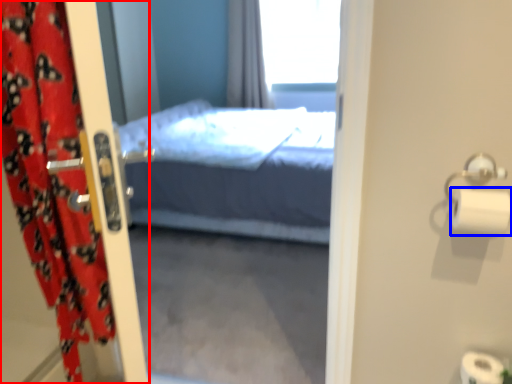
Question: Which object is closer to the camera taking this photo, curtain (highlighted by a red box) or toilet paper (highlighted by a blue box)?

Choices:
 (A) curtain
 (B) toilet paper

Answer: (A)